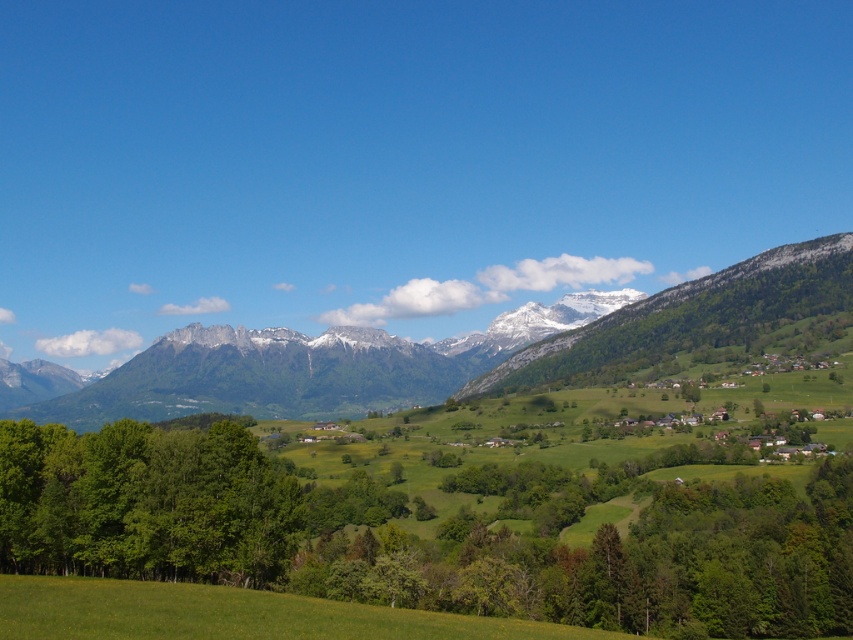
Looking at this image, can you confirm if green grassy mountain range at upper center is positioned below green leafy trees at left?

No, green grassy mountain range at upper center is not below green leafy trees at left.

Is green grassy mountain range at upper center shorter than green leafy trees at left?

No, green grassy mountain range at upper center is not shorter than green leafy trees at left.

Which is behind, point (234, 356) or point (264, 573)?

Positioned behind is point (234, 356).

Identify the location of green grassy mountain range at upper center. The width and height of the screenshot is (853, 640). (463, 349).